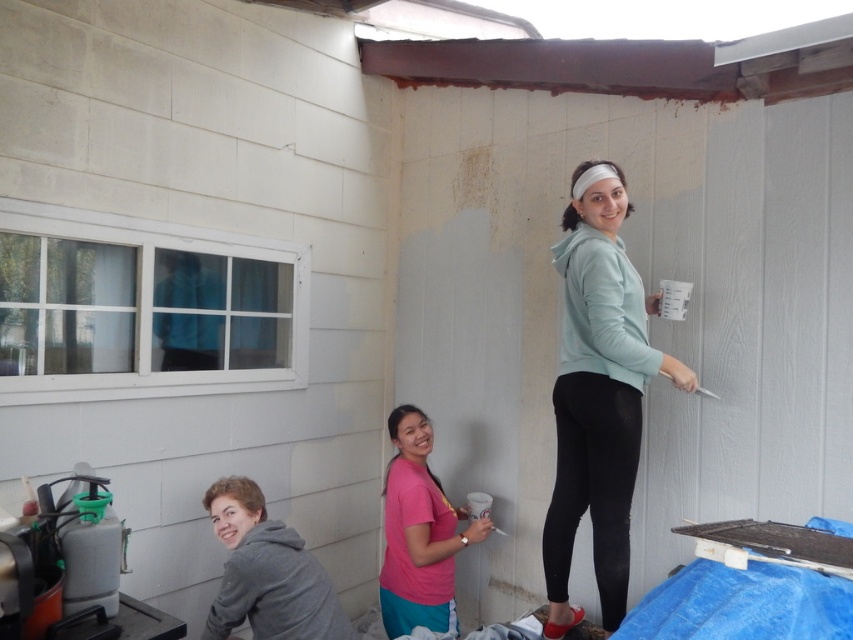
You are standing outside the shed and see the matte teal hoodie at center and the pink matte shirt at center. Which one is higher up?

The matte teal hoodie at center is above the pink matte shirt at center, so the matte teal hoodie at center is higher up.

You are observing two people working on a painting project in a shed. You notice the matte teal hoodie at center and the pink matte shirt at center. Which of these two clothing items is taller?

The matte teal hoodie at center is taller than the pink matte shirt at center.

You are standing at the origin point of the coordinate system in the image. There is a matte teal hoodie at center. What are its coordinates?

The coordinates of the matte teal hoodie at center are at point (598, 394).